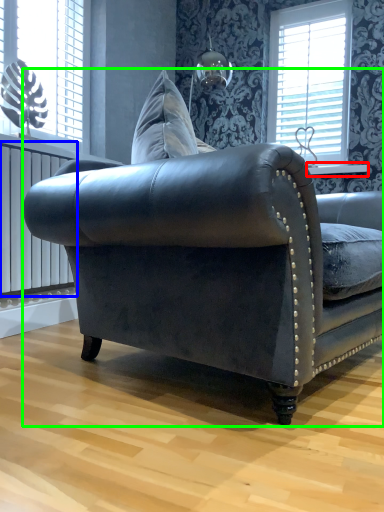
Question: Which is nearer to the window sill (highlighted by a red box)? radiator (highlighted by a blue box) or studio couch (highlighted by a green box).

Choices:
 (A) radiator
 (B) studio couch

Answer: (A)